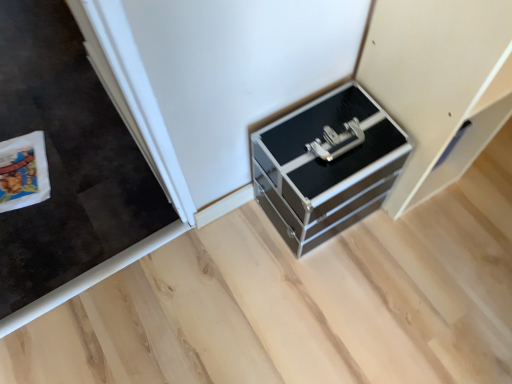
This screenshot has height=384, width=512. I want to click on vacant space that is to the left of metallic black chest of drawers at center, so click(234, 247).